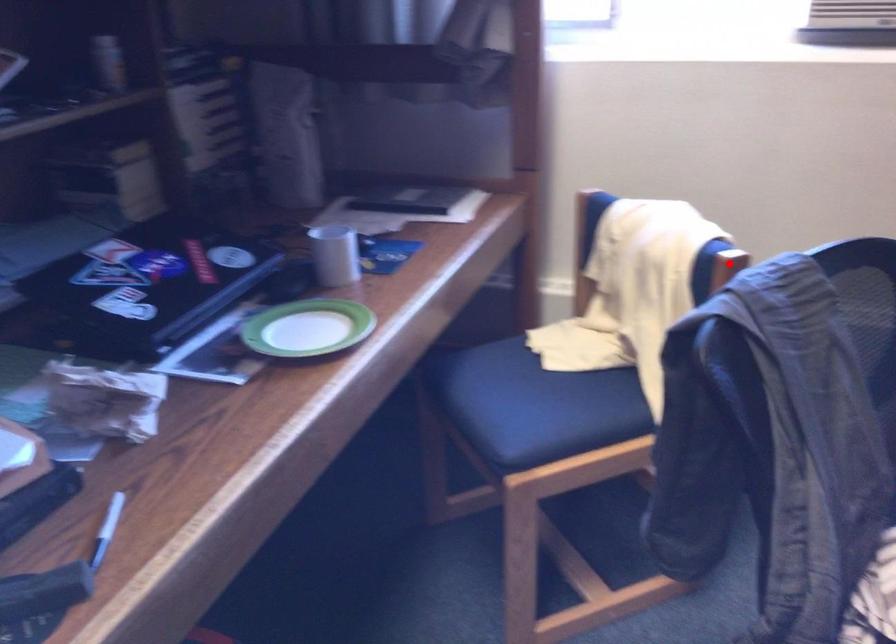
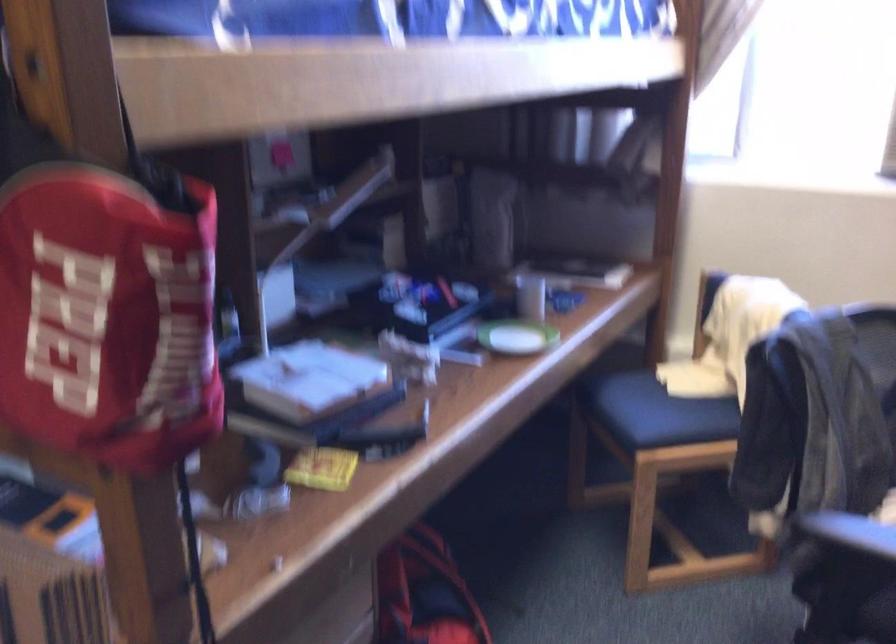
Question: I am providing you with two images of the same scene from different viewpoints. A red point is marked on the first image. At the location where the point appears in image 1, is it still visible in image 2?

Choices:
 (A) Yes
 (B) No

Answer: (B)